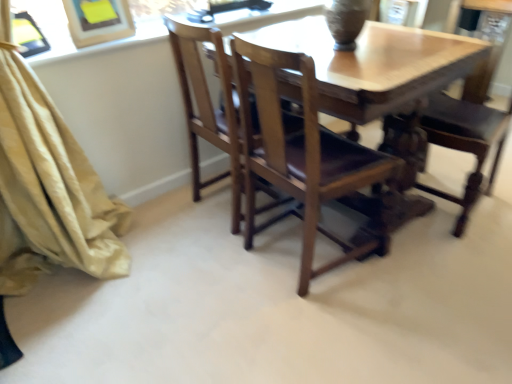
At what (x,y) coordinates should I click in order to perform the action: click on free spot to the left of wooden chair at center, the 1th chair from the left. Please return your answer as a coordinate pair (x, y). This screenshot has width=512, height=384. Looking at the image, I should click on (205, 269).